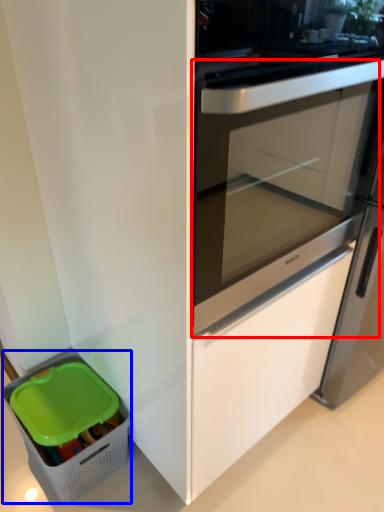
Question: Which point is further to the camera, screen door (highlighted by a red box) or storage box (highlighted by a blue box)?

Choices:
 (A) screen door
 (B) storage box

Answer: (B)